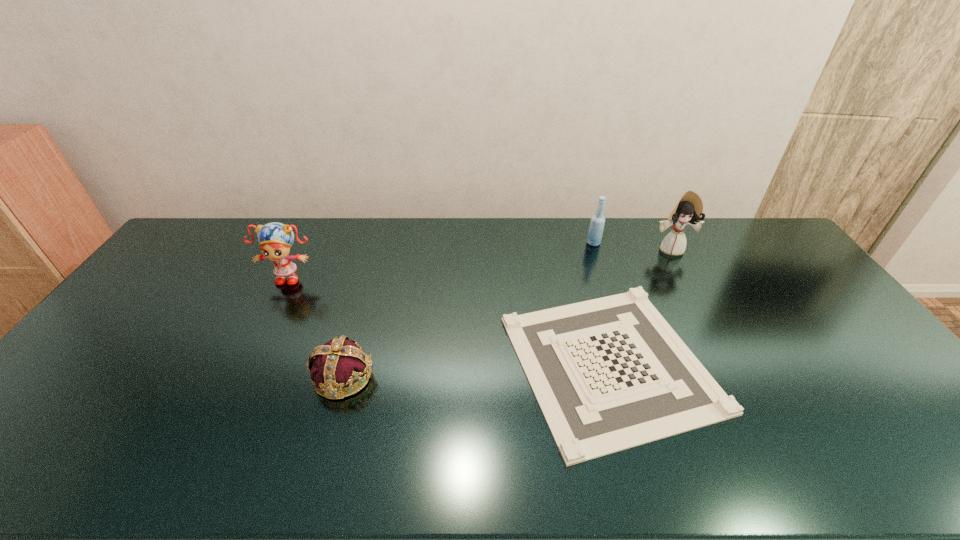
In order to click on free space located 0.200m on the right of the crown in this screenshot , I will do `click(451, 376)`.

I want to click on vacant space situated on the left of the shortest object, so click(x=444, y=363).

Where is `doll that is at the far edge`? doll that is at the far edge is located at coordinates (688, 210).

You are a GUI agent. You are given a task and a screenshot of the screen. Output one action in this format:
    pyautogui.click(x=<x>, y=<y>)
    Task: Click on the bottle located in the far edge section of the desktop
    
    Given the screenshot: What is the action you would take?
    pyautogui.click(x=595, y=232)

What are the coordinates of `object situated at the near edge` in the screenshot? It's located at (609, 374).

In the image, there is a desktop. What are the coordinates of `vacant space at the far edge` in the screenshot? It's located at (383, 230).

The height and width of the screenshot is (540, 960). What are the coordinates of `vacant space at the near edge of the desktop` in the screenshot? It's located at (218, 451).

Where is `vacant space at the left edge of the desktop`? This screenshot has width=960, height=540. vacant space at the left edge of the desktop is located at coordinates (192, 269).

You are a GUI agent. You are given a task and a screenshot of the screen. Output one action in this format:
    pyautogui.click(x=<x>, y=<y>)
    Task: Click on the vacant space at the right edge of the desktop
    This screenshot has width=960, height=540.
    Given the screenshot: What is the action you would take?
    pyautogui.click(x=792, y=260)

The height and width of the screenshot is (540, 960). I want to click on free location at the near right corner, so click(x=944, y=447).